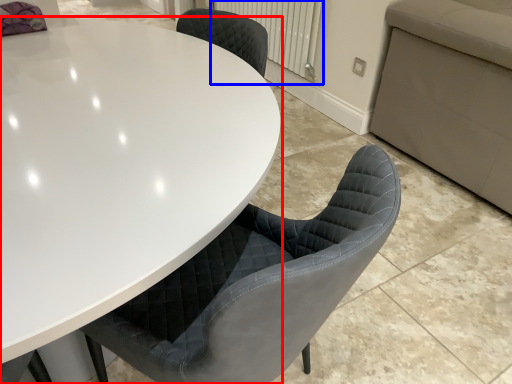
Question: Which of the following is the closest to the observer, table (highlighted by a red box) or radiator (highlighted by a blue box)?

Choices:
 (A) table
 (B) radiator

Answer: (A)